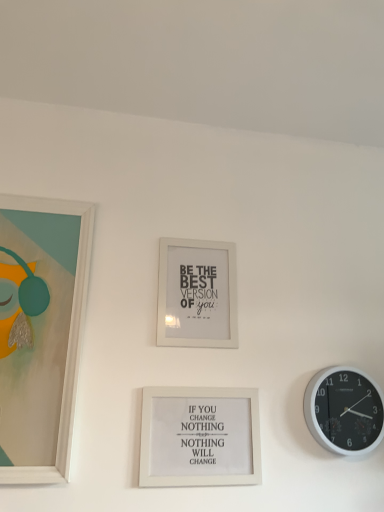
Question: From a real-world perspective, is matte white picture frame at left, which appears as the first picture frame when viewed from the left, on white matte picture frame at center, positioned as the third picture frame in left-to-right order?

Choices:
 (A) no
 (B) yes

Answer: (B)

Question: Does matte white picture frame at left, the third picture frame positioned from the right, lie behind white matte picture frame at center, positioned as the third picture frame in left-to-right order?

Choices:
 (A) no
 (B) yes

Answer: (A)

Question: Does matte white picture frame at left, the third picture frame positioned from the right, have a lesser width compared to white matte picture frame at center, which is counted as the 1th picture frame, starting from the right?

Choices:
 (A) yes
 (B) no

Answer: (B)

Question: Does matte white picture frame at left, which appears as the first picture frame when viewed from the left, have a larger size compared to white matte picture frame at center, which is counted as the 1th picture frame, starting from the right?

Choices:
 (A) no
 (B) yes

Answer: (B)

Question: Considering the relative positions of matte white picture frame at left, which appears as the first picture frame when viewed from the left, and white matte picture frame at center, which is counted as the 1th picture frame, starting from the right, in the image provided, is matte white picture frame at left, which appears as the first picture frame when viewed from the left, to the right of white matte picture frame at center, which is counted as the 1th picture frame, starting from the right, from the viewer's perspective?

Choices:
 (A) yes
 (B) no

Answer: (B)

Question: Looking at their shapes, would you say white matte picture frame at center, the second picture frame in the right-to-left sequence, is wider or thinner than white matte picture frame at center, positioned as the third picture frame in left-to-right order?

Choices:
 (A) wide
 (B) thin

Answer: (B)

Question: From a real-world perspective, is white matte picture frame at center, the 2th picture frame from the left, above or below white matte picture frame at center, positioned as the third picture frame in left-to-right order?

Choices:
 (A) above
 (B) below

Answer: (A)

Question: Which is correct: white matte picture frame at center, the second picture frame in the right-to-left sequence, is inside white matte picture frame at center, positioned as the third picture frame in left-to-right order, or outside of it?

Choices:
 (A) outside
 (B) inside

Answer: (A)

Question: From the image's perspective, is white matte picture frame at center, the 2th picture frame from the left, located above or below white matte picture frame at center, positioned as the third picture frame in left-to-right order?

Choices:
 (A) below
 (B) above

Answer: (B)

Question: Looking at their shapes, would you say black plastic wall clock at right is wider or thinner than white matte picture frame at center, the second picture frame in the right-to-left sequence?

Choices:
 (A) wide
 (B) thin

Answer: (A)

Question: From a real-world perspective, is black plastic wall clock at right physically located above or below white matte picture frame at center, the second picture frame in the right-to-left sequence?

Choices:
 (A) above
 (B) below

Answer: (B)

Question: Is black plastic wall clock at right situated inside white matte picture frame at center, the second picture frame in the right-to-left sequence, or outside?

Choices:
 (A) inside
 (B) outside

Answer: (B)

Question: Based on their positions, is black plastic wall clock at right located to the left or right of white matte picture frame at center, the second picture frame in the right-to-left sequence?

Choices:
 (A) left
 (B) right

Answer: (B)

Question: Looking at the image, does matte white picture frame at left, which appears as the first picture frame when viewed from the left, seem bigger or smaller compared to black plastic wall clock at right?

Choices:
 (A) big
 (B) small

Answer: (A)

Question: From a real-world perspective, is matte white picture frame at left, which appears as the first picture frame when viewed from the left, above or below black plastic wall clock at right?

Choices:
 (A) below
 (B) above

Answer: (B)